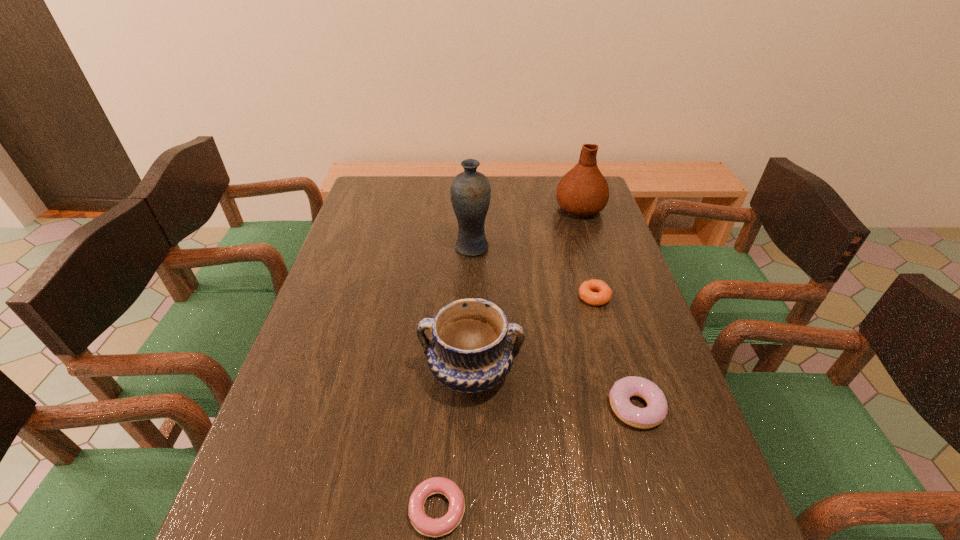
The image size is (960, 540). Find the location of `vase`. vase is located at coordinates (470, 191).

Find the location of a particular element. Image resolution: width=960 pixels, height=540 pixels. the tallest object is located at coordinates tap(470, 191).

I want to click on the second tallest object, so click(x=583, y=191).

You are a GUI agent. You are given a task and a screenshot of the screen. Output one action in this format:
    pyautogui.click(x=<x>, y=<y>)
    Task: Click on the farthest object
    This screenshot has height=540, width=960.
    Given the screenshot: What is the action you would take?
    pyautogui.click(x=583, y=191)

I want to click on pottery, so click(x=470, y=351).

Find the location of a particular element. the tallest doughnut is located at coordinates (657, 408).

At what (x,y) coordinates should I click in order to perform the action: click on the fourth tallest object. Please return your answer as a coordinate pair (x, y). The width and height of the screenshot is (960, 540). Looking at the image, I should click on (657, 408).

Locate an element on the screen. the farthest doughnut is located at coordinates (595, 292).

Locate an element on the screen. The width and height of the screenshot is (960, 540). the fourth nearest object is located at coordinates (595, 292).

The width and height of the screenshot is (960, 540). Find the location of `vacant space located 0.190m on the front of the second farthest object`. vacant space located 0.190m on the front of the second farthest object is located at coordinates (470, 303).